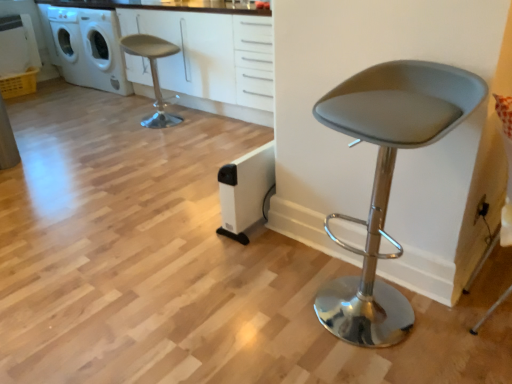
Locate an element on the screen. The width and height of the screenshot is (512, 384). free spot to the left of matte gray stool at center, positioned as the 1th chair in front-to-back order is located at coordinates point(271,316).